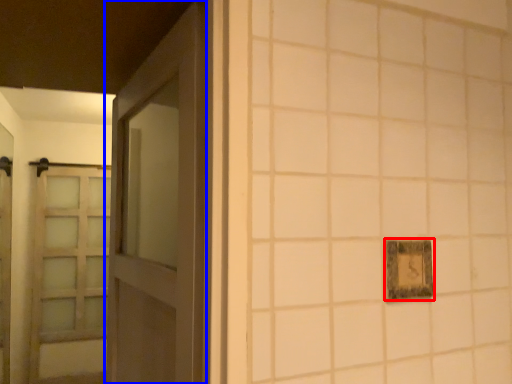
Question: Which object is closer to the camera taking this photo, picture frame (highlighted by a red box) or door (highlighted by a blue box)?

Choices:
 (A) picture frame
 (B) door

Answer: (B)